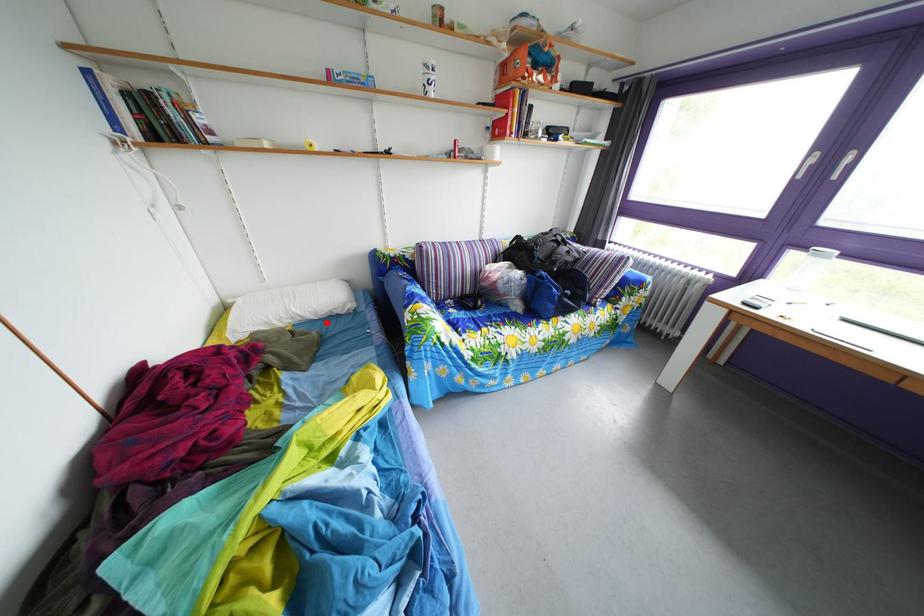
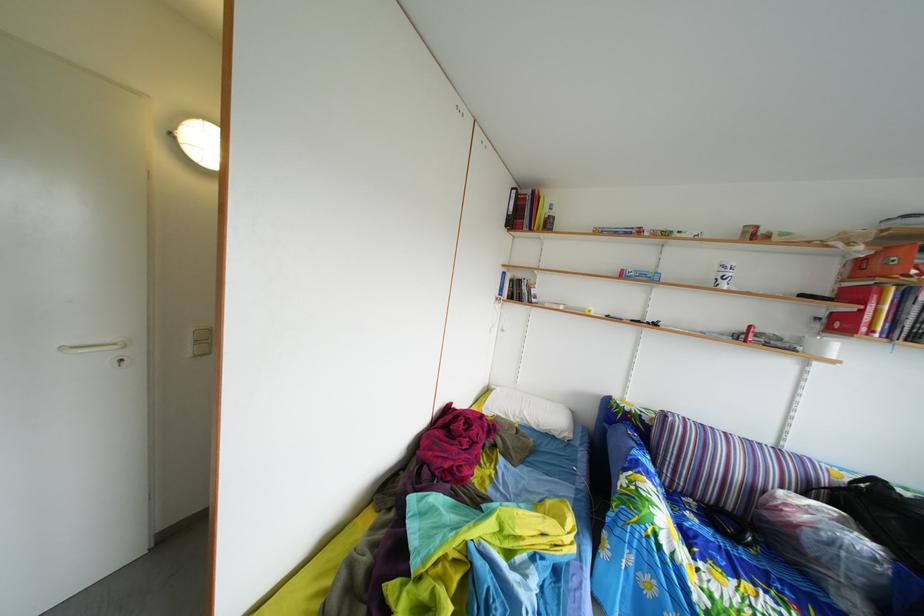
Locate, in the second image, the point that corresponds to the highlighted location in the first image.

(549, 434)